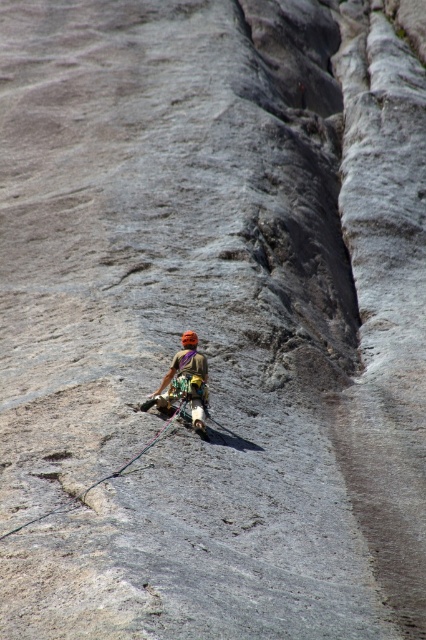
You are a drone operator trying to capture a closeup shot of the climber. The drone is currently positioned above the climber. The camera is facing downward. The drone can move in any direction. What is the 2D coordinate where you should direct the camera to focus on the matte orange helmet at center?

The 2D coordinate to focus on the matte orange helmet at center is at point (x=184, y=384).

You are a safety inspector reviewing the rock climbing setup. The matte orange helmet at center and the black nylon rope at center are critical for safety. Based on their sizes, which one is more likely to be within the standard safety specifications?

The matte orange helmet at center has a larger size compared to the black nylon rope at center. Safety specifications typically require helmets to be of adequate size to provide proper protection, so the matte orange helmet at center is more likely to meet safety standards if its size aligns with the required specifications.

You are a safety inspector reviewing this climbing setup. The safety regulations state that the helmet must be within 20 inches of the rope to ensure proper harness attachment. Based on the image, does the matte orange helmet at center meet this requirement relative to the black nylon rope at center?

The distance between the matte orange helmet at center and the black nylon rope at center is 19.61 inches, which is within the 20 inches requirement. Therefore, the helmet meets the safety regulation.